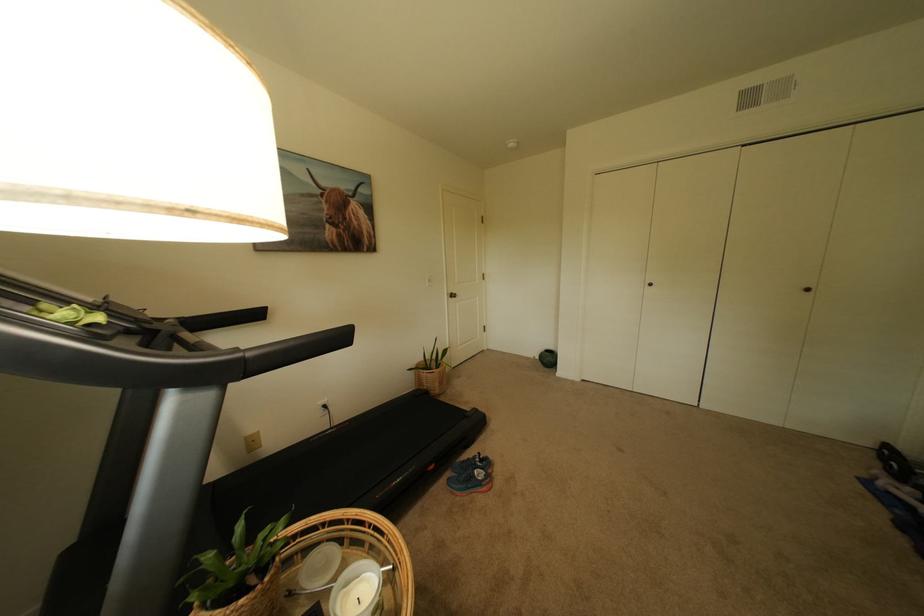
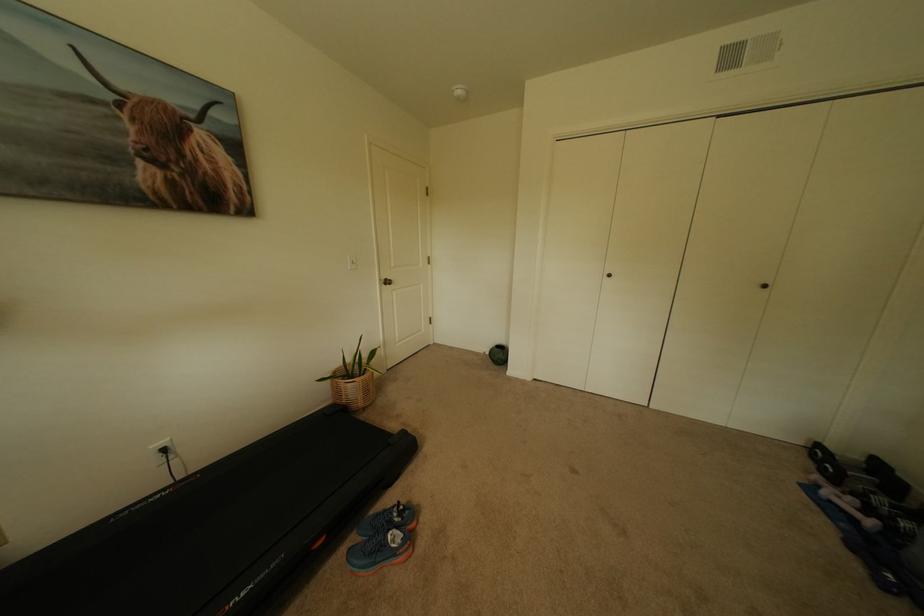
Question: The camera is either moving clockwise (left) or counter-clockwise (right) around the object. The first image is from the beginning of the video and the second image is from the end. Is the camera moving left or right when shooting the video?

Choices:
 (A) Left
 (B) Right

Answer: (A)